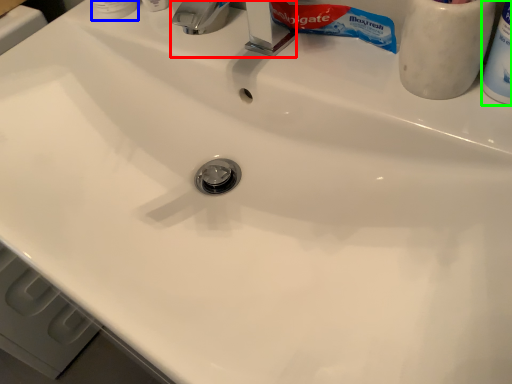
Question: Which is farther away from faucet (highlighted by a red box)? toiletry (highlighted by a blue box) or toiletry (highlighted by a green box)?

Choices:
 (A) toiletry
 (B) toiletry

Answer: (B)